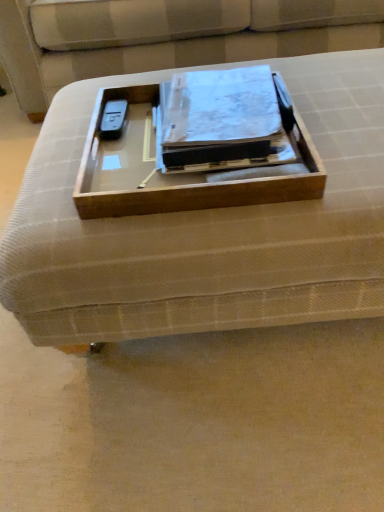
The width and height of the screenshot is (384, 512). Identify the location of free location to the right of matte plastic binder at center. (334, 115).